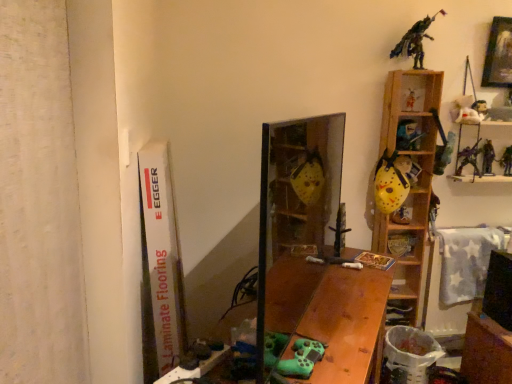
Image resolution: width=512 pixels, height=384 pixels. In order to click on vacant area on the back side of green matte controller at lower center, which is counted as the 1th toy, starting from the left in this screenshot , I will do `click(316, 328)`.